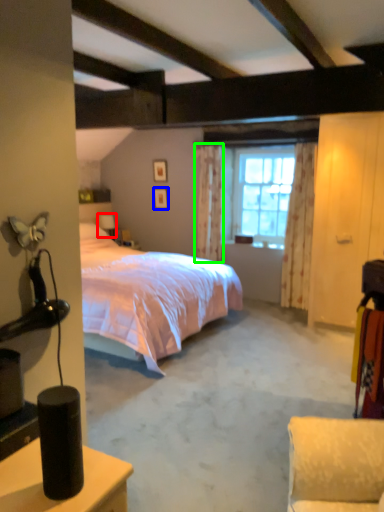
Question: Which object is the farthest from table lamp (highlighted by a red box)? Choose among these: picture frame (highlighted by a blue box) or curtain (highlighted by a green box).

Choices:
 (A) picture frame
 (B) curtain

Answer: (B)